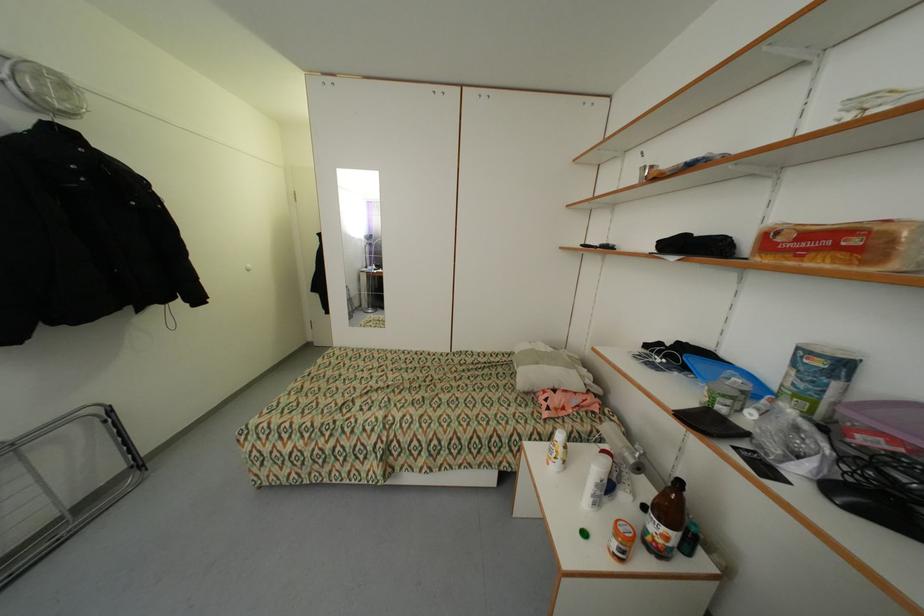
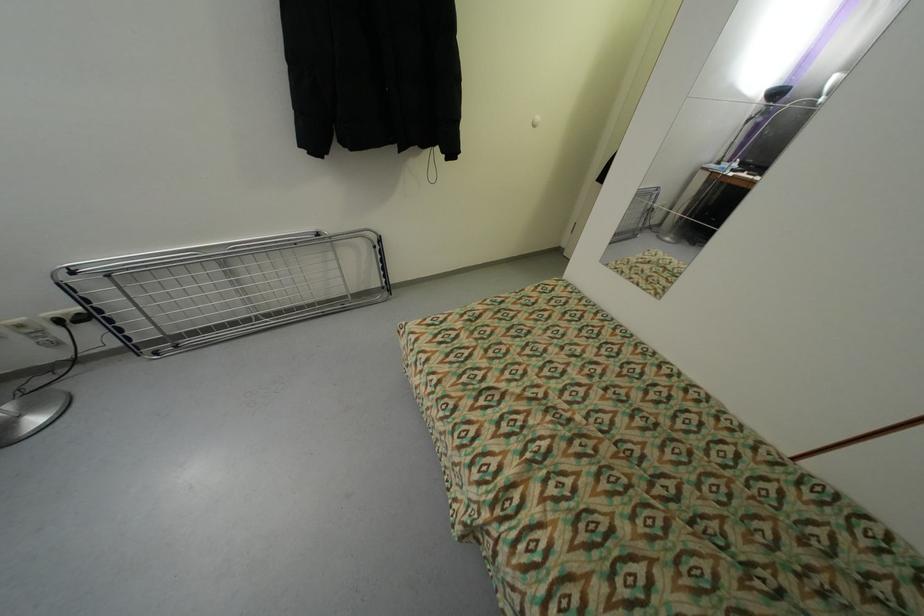
First-person continuous shooting, in which direction is the camera rotating?

The camera rotated toward left-down.